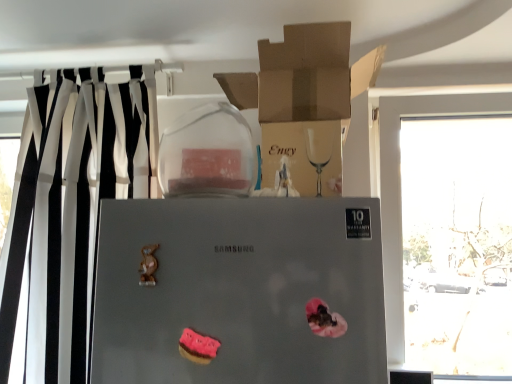
Question: Can you confirm if satin silver refrigerator at center is taller than pink frosted cookie at lower center?

Choices:
 (A) no
 (B) yes

Answer: (B)

Question: From the image's perspective, would you say satin silver refrigerator at center is shown under pink frosted cookie at lower center?

Choices:
 (A) yes
 (B) no

Answer: (B)

Question: Is satin silver refrigerator at center positioned with its back to pink frosted cookie at lower center?

Choices:
 (A) no
 (B) yes

Answer: (B)

Question: From a real-world perspective, is satin silver refrigerator at center located beneath pink frosted cookie at lower center?

Choices:
 (A) yes
 (B) no

Answer: (B)

Question: Can you see satin silver refrigerator at center touching pink frosted cookie at lower center?

Choices:
 (A) no
 (B) yes

Answer: (A)

Question: Does point (301, 81) appear closer or farther from the camera than point (195, 359)?

Choices:
 (A) farther
 (B) closer

Answer: (A)

Question: In the image, is brown cardboard box at upper center on the left side or the right side of pink frosted cookie at lower center?

Choices:
 (A) left
 (B) right

Answer: (B)

Question: Is brown cardboard box at upper center in front of or behind pink frosted cookie at lower center in the image?

Choices:
 (A) front
 (B) behind

Answer: (B)

Question: From a real-world perspective, is brown cardboard box at upper center physically located above or below pink frosted cookie at lower center?

Choices:
 (A) above
 (B) below

Answer: (A)

Question: Is black/white striped curtain at left in front of or behind pink frosted cookie at lower center in the image?

Choices:
 (A) front
 (B) behind

Answer: (B)

Question: Which is correct: black/white striped curtain at left is inside pink frosted cookie at lower center, or outside of it?

Choices:
 (A) inside
 (B) outside

Answer: (B)

Question: From a real-world perspective, is black/white striped curtain at left positioned above or below pink frosted cookie at lower center?

Choices:
 (A) below
 (B) above

Answer: (B)

Question: Considering the positions of black/white striped curtain at left and pink frosted cookie at lower center in the image, is black/white striped curtain at left wider or thinner than pink frosted cookie at lower center?

Choices:
 (A) wide
 (B) thin

Answer: (A)

Question: Do you think pink frosted cookie at lower center is within brown cardboard box at upper center, or outside of it?

Choices:
 (A) outside
 (B) inside

Answer: (A)

Question: Considering the positions of pink frosted cookie at lower center and brown cardboard box at upper center in the image, is pink frosted cookie at lower center taller or shorter than brown cardboard box at upper center?

Choices:
 (A) short
 (B) tall

Answer: (A)